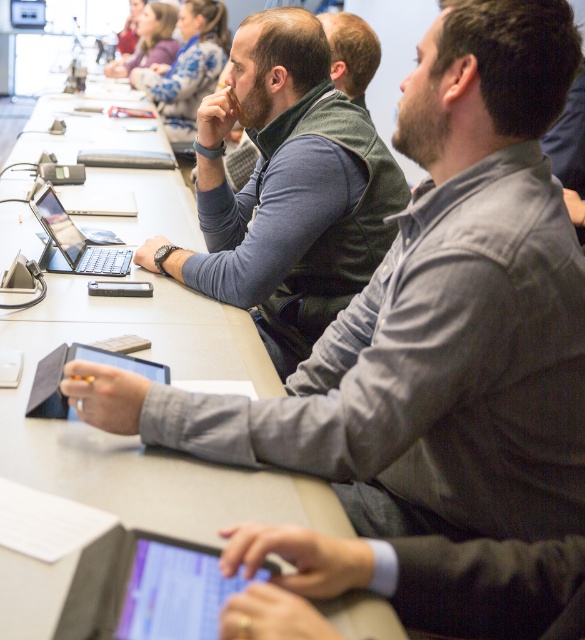
Locate an element on the screen. This screenshot has height=640, width=585. matte green vest at center is located at coordinates (187, 67).

Which is in front, point (204, 8) or point (143, 38)?

Point (204, 8)

What do you see at coordinates (187, 67) in the screenshot? I see `matte green vest at center` at bounding box center [187, 67].

This screenshot has width=585, height=640. I want to click on matte green vest at center, so click(x=187, y=67).

Between black matte tablet at center and matte green vest at center, which one has less height?

Standing shorter between the two is black matte tablet at center.

Measure the distance between black matte tablet at center and camera.

They are 27.62 inches apart.

What do you see at coordinates (174, 589) in the screenshot?
I see `black matte tablet at center` at bounding box center [174, 589].

Where is `black matte tablet at center`? This screenshot has width=585, height=640. black matte tablet at center is located at coordinates (174, 589).

Which is in front, point (250, 330) or point (338, 145)?

Point (250, 330) is in front.

Based on the photo, can you confirm if gray matte table at center is positioned to the left of matte blue shirt at center?

Indeed, gray matte table at center is positioned on the left side of matte blue shirt at center.

Consider the image. Who is more distant from viewer, [176,520] or [277,177]?

Positioned behind is point [277,177].

Image resolution: width=585 pixels, height=640 pixels. Find the location of `gray matte table at center`. gray matte table at center is located at coordinates (136, 436).